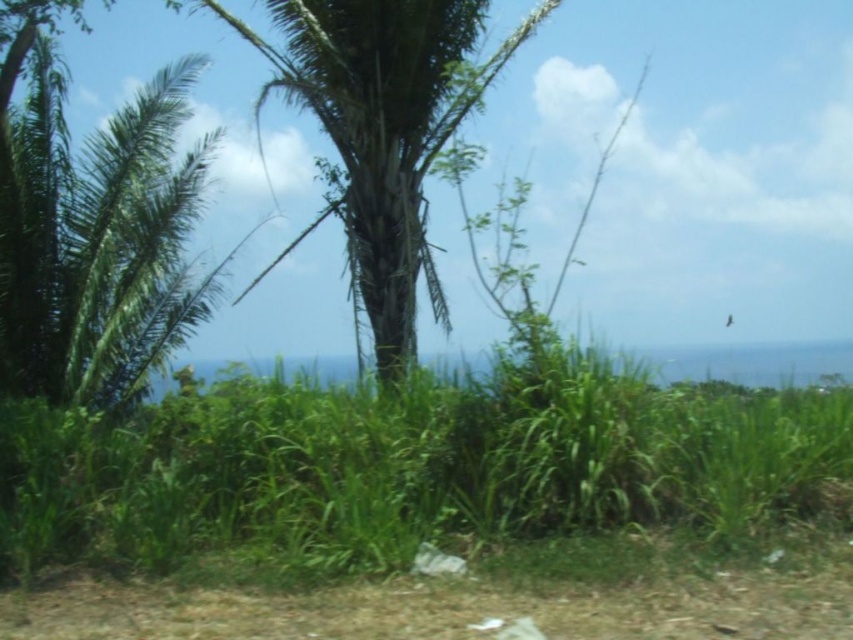
Question: Is green leafy grass at lower center wider than green leafy palm tree at center?

Choices:
 (A) no
 (B) yes

Answer: (B)

Question: Does green leafy grass at lower center appear on the left side of green leafy palm tree at center?

Choices:
 (A) yes
 (B) no

Answer: (B)

Question: Is green leafy grass at lower center bigger than green leafy palm tree at center?

Choices:
 (A) no
 (B) yes

Answer: (A)